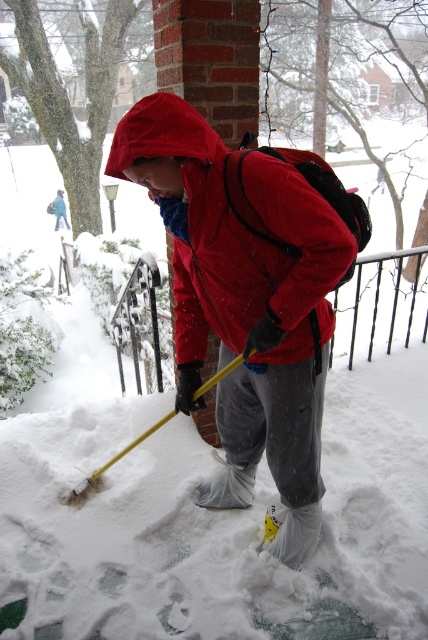
Question: Which object is farther from the camera taking this photo?

Choices:
 (A) matte black snow shovel at lower left
 (B) matte nylon jacket at center

Answer: (A)

Question: Which point is farther to the camera?

Choices:
 (A) matte nylon jacket at center
 (B) matte black snow shovel at lower left
 (C) yellow plastic shovel at lower center

Answer: (B)

Question: Can you confirm if matte nylon jacket at center is smaller than matte black snow shovel at lower left?

Choices:
 (A) yes
 (B) no

Answer: (A)

Question: Which point is closer to the camera?

Choices:
 (A) (237, 346)
 (B) (246, 356)
 (C) (50, 212)

Answer: (B)

Question: Is matte nylon jacket at center above matte black snow shovel at lower left?

Choices:
 (A) no
 (B) yes

Answer: (A)

Question: Is yellow plastic shovel at lower center thinner than matte black snow shovel at lower left?

Choices:
 (A) yes
 (B) no

Answer: (A)